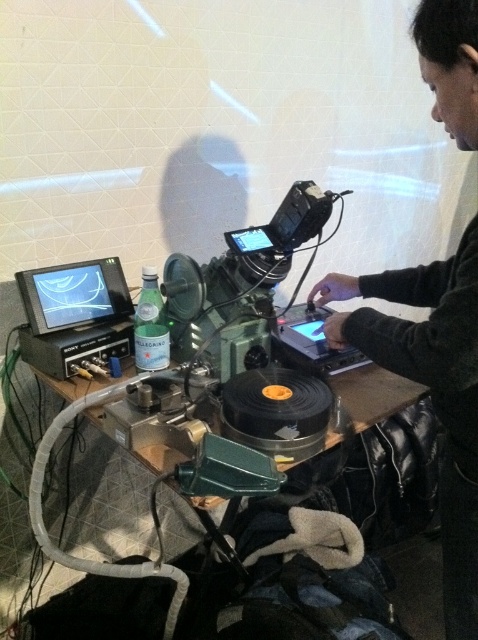
Can you confirm if dark gray sweater at center is shorter than wooden table at center?

Incorrect, dark gray sweater at center's height does not fall short of wooden table at center's.

Identify the location of dark gray sweater at center. The width and height of the screenshot is (478, 640). [431, 388].

Does point (440, 76) lie in front of point (150, 456)?

Yes, point (440, 76) is in front of point (150, 456).

Where is `dark gray sweater at center`? dark gray sweater at center is located at coordinates (431, 388).

Which is more to the left, metallic black video camera at center or wooden table at center?

Positioned to the left is metallic black video camera at center.

Which is more to the right, metallic black video camera at center or wooden table at center?

wooden table at center is more to the right.

This screenshot has width=478, height=640. What are the coordinates of `metallic black video camera at center` in the screenshot? It's located at (241, 269).

Is point (460, 589) closer to camera compared to point (246, 266)?

Yes, point (460, 589) is in front of point (246, 266).

Between dark gray sweater at center and metallic black video camera at center, which one appears on the right side from the viewer's perspective?

From the viewer's perspective, dark gray sweater at center appears more on the right side.

Which is behind, point (455, 92) or point (246, 364)?

The point (246, 364) is more distant.

The width and height of the screenshot is (478, 640). In order to click on dark gray sweater at center in this screenshot , I will do `click(431, 388)`.